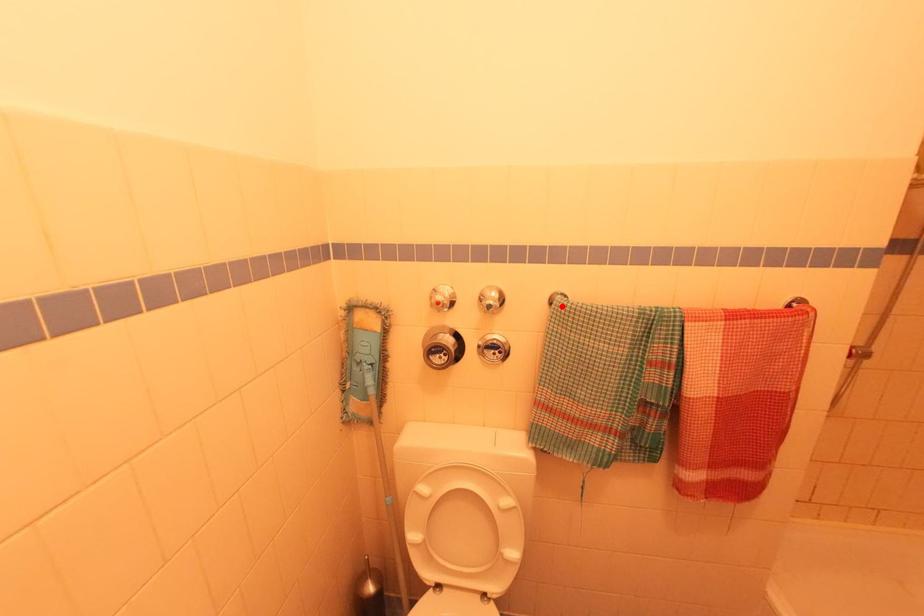
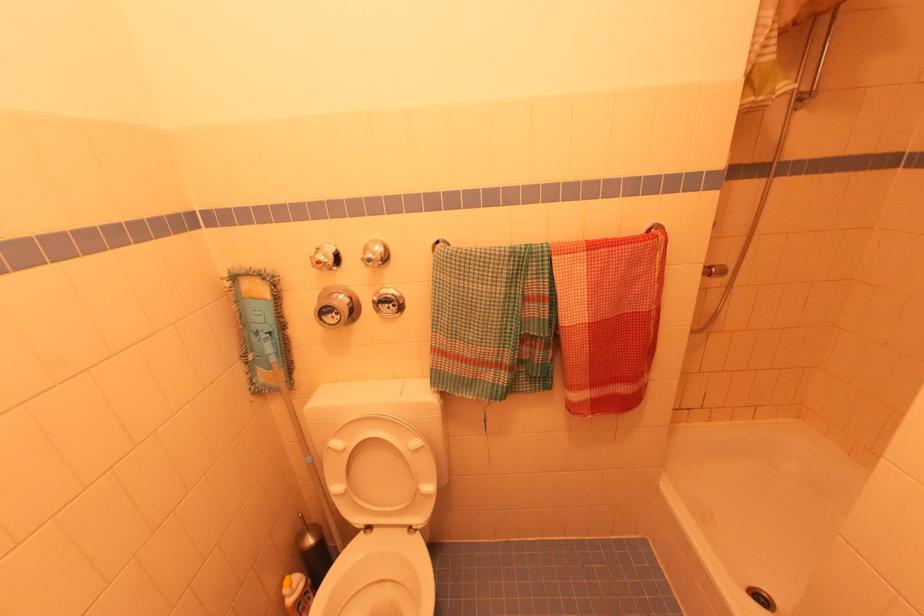
The point at the highlighted location is marked in the first image. Where is the corresponding point in the second image?

(441, 253)